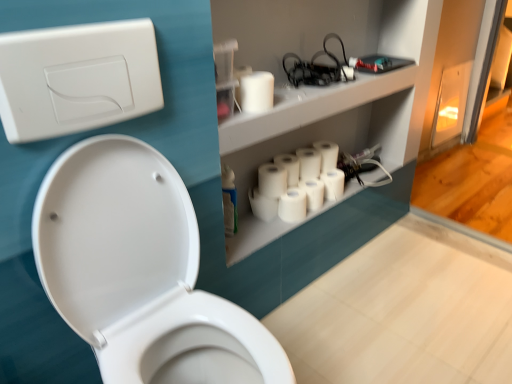
Question: Considering their positions, is white matte toilet paper at center, positioned as the 7th toilet paper in front-to-back order, located in front of or behind white matte toilet paper at center, placed as the 3th toilet paper when sorted from front to back?

Choices:
 (A) front
 (B) behind

Answer: (B)

Question: Does point (296, 152) appear closer or farther from the camera than point (293, 206)?

Choices:
 (A) farther
 (B) closer

Answer: (A)

Question: Which object is the closest to the white matte toilet paper at center, positioned as the sixth toilet paper in front-to-back order?

Choices:
 (A) white matte toilet paper at center, positioned as the 9th toilet paper in front-to-back order
 (B) white matte toilet paper at center, the fifth toilet paper in the front-to-back sequence
 (C) white matte toilet paper at center, positioned as the 2th toilet paper in back-to-front order
 (D) white matte toilet paper at center, arranged as the eighth toilet paper when viewed from the back
 (E) white glossy toilet at center

Answer: (C)

Question: Estimate the real-world distances between objects in this image. Which object is closer to the white matte toilet paper at center, acting as the fourth toilet paper starting from the front?

Choices:
 (A) white matte toilet paper at center, acting as the 5th toilet paper starting from the back
 (B) white matte toilet paper at center, which is the first toilet paper in back-to-front order
 (C) white plastic/light switch at upper left
 (D) white matte toilet paper at center, which is the seventh toilet paper from back to front
 (E) white matte toilet paper at center, arranged as the eighth toilet paper when viewed from the back

Answer: (E)